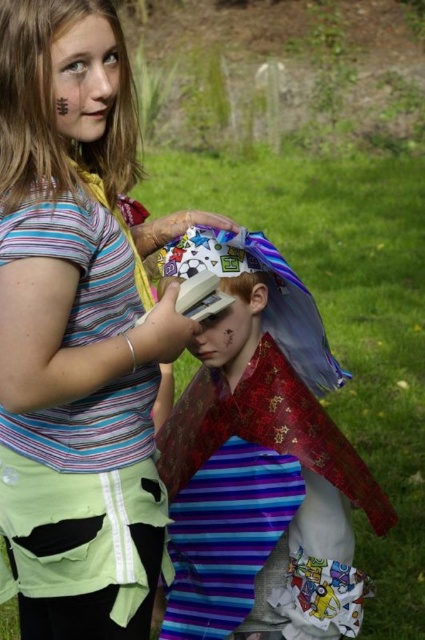
Does point (47, 100) come closer to viewer compared to point (277, 420)?

Yes, point (47, 100) is closer to viewer.

Which is behind, point (6, 429) or point (176, 500)?

Point (176, 500)

Locate an element on the screen. This screenshot has width=425, height=640. striped fabric dress at center is located at coordinates (78, 316).